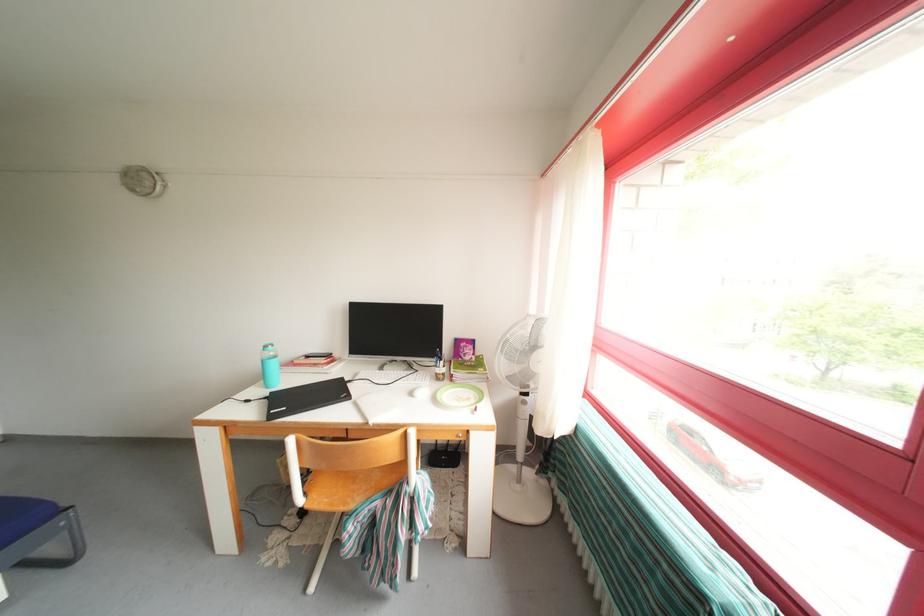
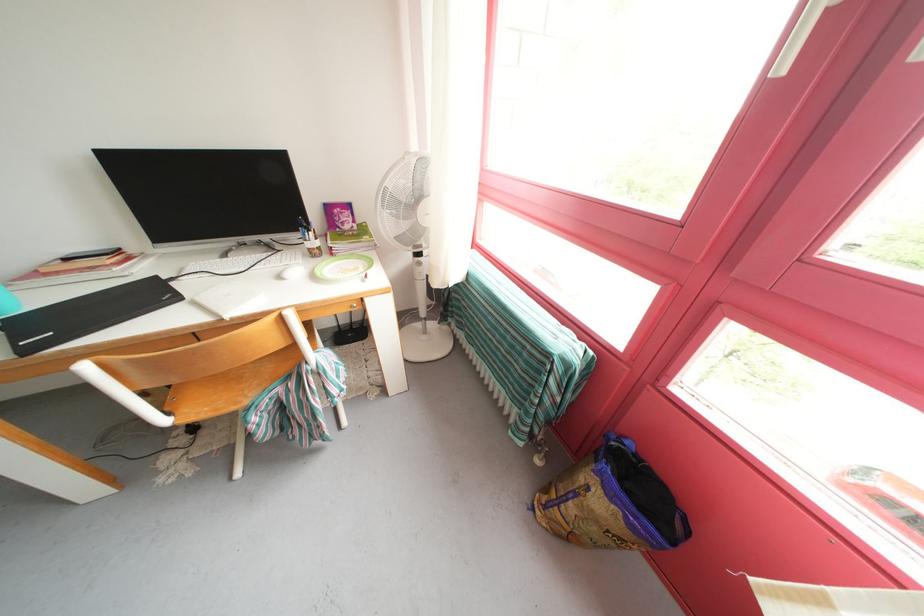
The point at (349, 384) is marked in the first image. Where is the corresponding point in the second image?

(164, 283)